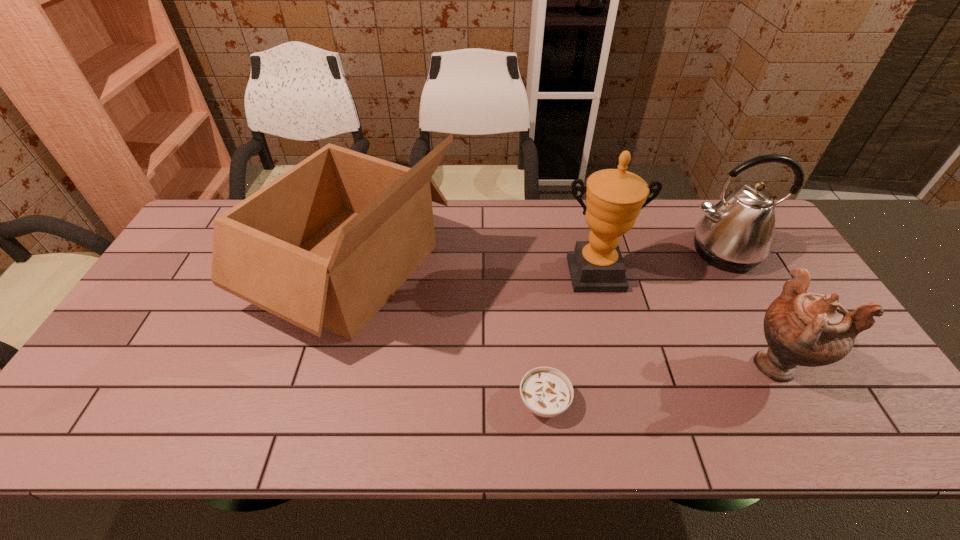
Image resolution: width=960 pixels, height=540 pixels. Find the location of `vacant space in between the box and the urn`. vacant space in between the box and the urn is located at coordinates (564, 316).

Where is `object that stands as the third closest to the third object from left to right`? The height and width of the screenshot is (540, 960). object that stands as the third closest to the third object from left to right is located at coordinates (547, 392).

Find the location of `the third closest object to the soup bowl`. the third closest object to the soup bowl is located at coordinates (801, 328).

Image resolution: width=960 pixels, height=540 pixels. I want to click on blank area in the image that satisfies the following two spatial constraints: 1. at the front of the third object from left to right with handles; 2. on the right side of the urn, so click(617, 364).

You are a GUI agent. You are given a task and a screenshot of the screen. Output one action in this format:
    pyautogui.click(x=<x>, y=<y>)
    Task: Click on the vacant area in the image that satisfies the following two spatial constraints: 1. on the front side of the box; 2. on the left side of the shortest object
    
    Given the screenshot: What is the action you would take?
    pyautogui.click(x=312, y=402)

This screenshot has height=540, width=960. In order to click on free region that satisfies the following two spatial constraints: 1. at the front of the award with handles; 2. on the left side of the urn in this screenshot , I will do `click(617, 364)`.

Identify the location of vacant space that satisfies the following two spatial constraints: 1. on the back side of the second object from left to right; 2. on the right side of the second shortest object. This screenshot has height=540, width=960. point(540,364).